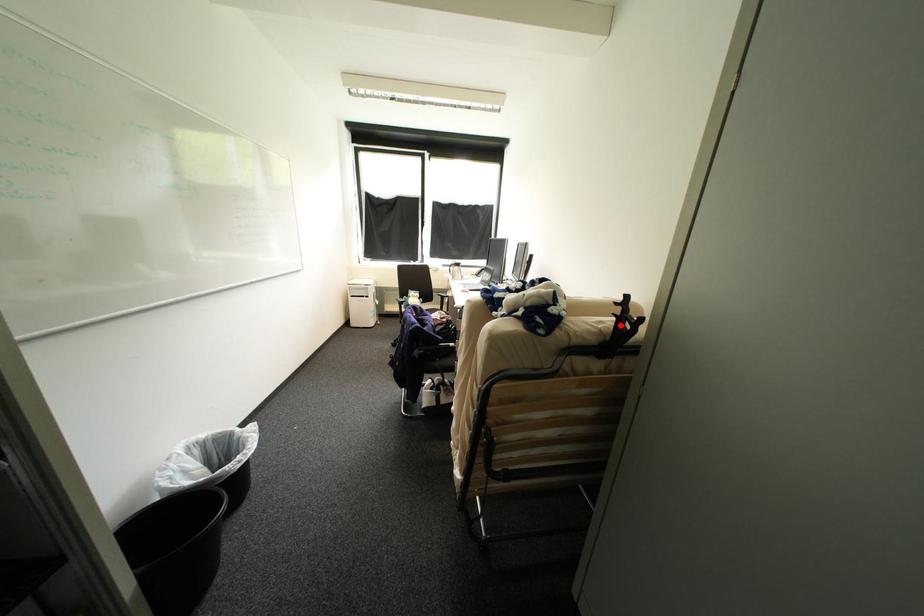
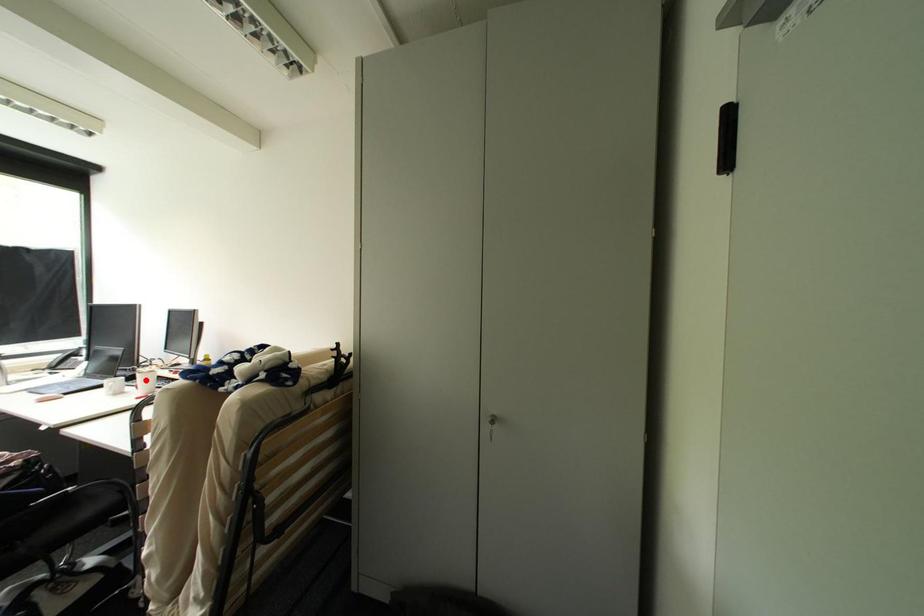
I am providing you with two images of the same scene from different viewpoints. A red point is marked on the first image and another point is marked on the second image. Are the points marked in image1 and image2 representing the same 3D position?

No